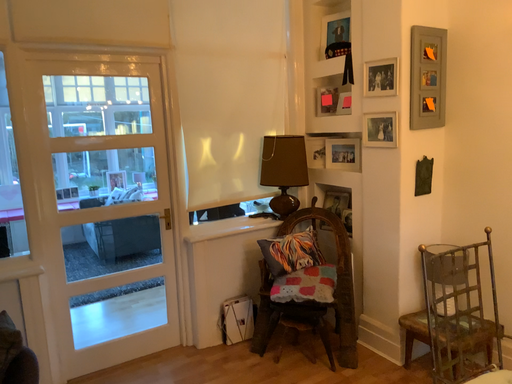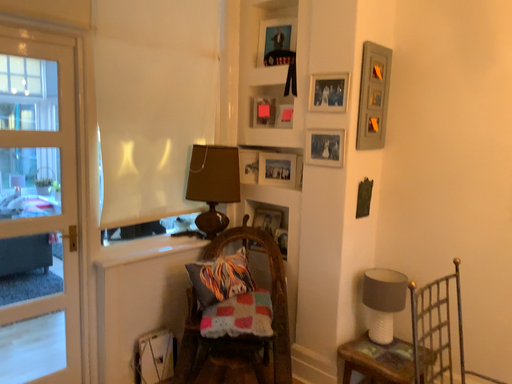
Question: How did the camera likely rotate when shooting the video?

Choices:
 (A) rotated left
 (B) rotated right

Answer: (B)